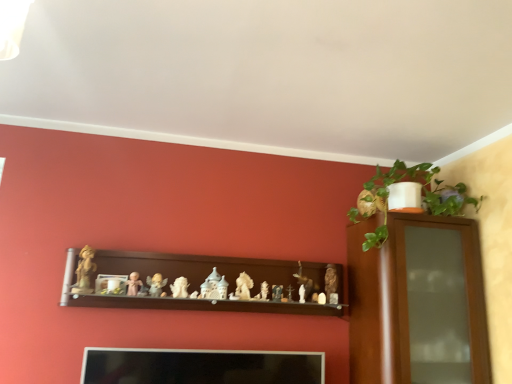
Question: Would you say smooth wooden cross at center, acting as the ninth toy starting from the left, is inside or outside matte brown statue at center, arranged as the eleventh toy when viewed from the left?

Choices:
 (A) outside
 (B) inside

Answer: (A)

Question: In terms of height, does smooth wooden cross at center, which ranks as the 3th toy in right-to-left order, look taller or shorter compared to matte brown statue at center, which is counted as the first toy, starting from the right?

Choices:
 (A) short
 (B) tall

Answer: (A)

Question: Which of these objects is positioned closest to the matte gold statue at left, the 11th toy from the right?

Choices:
 (A) matte white figurine at center, which ranks as the eighth toy in left-to-right order
 (B) matte brown statue at center, arranged as the eleventh toy when viewed from the left
 (C) green glossy plant at upper right
 (D) smooth wooden cross at center, which ranks as the 3th toy in right-to-left order
 (E) matte beige figurine at center, the 2th toy viewed from the left

Answer: (E)

Question: Which of these objects is positioned farthest from the white porcelain statue at center, which ranks as the 6th toy in left-to-right order?

Choices:
 (A) white glossy statue at center, positioned as the fourth toy in left-to-right order
 (B) matte gold figurine at center, which is counted as the second toy, starting from the right
 (C) green glossy plant at upper right
 (D) white porcelain castle at center, which appears as the 5th toy when viewed from the left
 (E) matte brown statue at center, arranged as the eleventh toy when viewed from the left

Answer: (C)